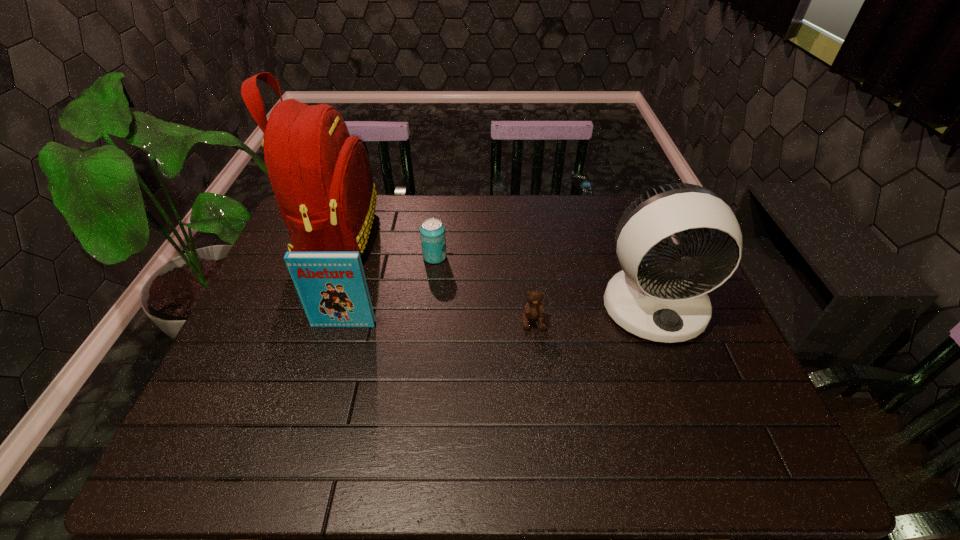
Locate an element on the screen. This screenshot has width=960, height=540. vacant space situated 0.230m on the front cover of the third shortest object is located at coordinates (320, 409).

Locate an element on the screen. The image size is (960, 540). vacant space located 0.180m on the front of the third object from right to left is located at coordinates (429, 310).

Identify the location of vacant position located 0.320m on the face of the teddy bear. The image size is (960, 540). (548, 454).

Find the location of `object that is at the far edge`. object that is at the far edge is located at coordinates (321, 176).

Identify the location of object that is positioned at the left edge. The height and width of the screenshot is (540, 960). (321, 176).

Find the location of a particular element. The width and height of the screenshot is (960, 540). object at the right edge is located at coordinates (664, 299).

The image size is (960, 540). Identify the location of object that is at the far left corner. (321, 176).

You are a GUI agent. You are given a task and a screenshot of the screen. Output one action in this format:
    pyautogui.click(x=<x>, y=<y>)
    Task: Click on the vacant area at the far edge of the desktop
    The height and width of the screenshot is (540, 960).
    Given the screenshot: What is the action you would take?
    pyautogui.click(x=543, y=228)

Find the location of `free space at the near edge of the desktop`. free space at the near edge of the desktop is located at coordinates (478, 453).

Where is `free space at the left edge of the desktop`? free space at the left edge of the desktop is located at coordinates (237, 384).